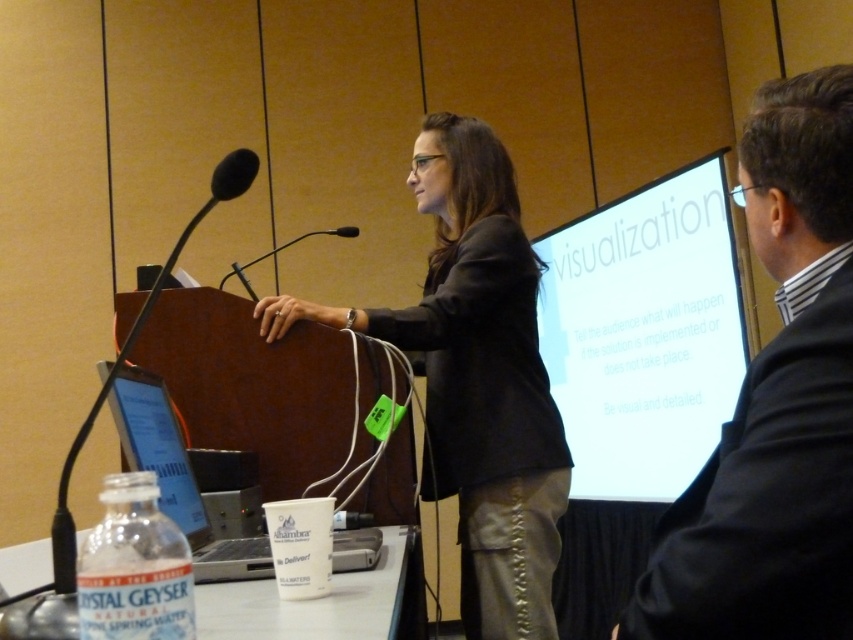
Question: Is transparent plastic screen at lower left further to camera compared to black plastic microphone at center?

Choices:
 (A) no
 (B) yes

Answer: (A)

Question: Which of the following is the closest to the observer?

Choices:
 (A) (247, 285)
 (B) (799, 410)

Answer: (B)

Question: Among these points, which one is farthest from the camera?

Choices:
 (A) (231, 189)
 (B) (234, 264)

Answer: (B)

Question: Is dark gray blazer at center below transparent plastic screen at lower left?

Choices:
 (A) no
 (B) yes

Answer: (A)

Question: Which of the following is the farthest from the observer?

Choices:
 (A) black matte microphone at upper left
 (B) black matte microphone at center

Answer: (B)

Question: Does black matte microphone at left lie behind black matte microphone at upper left?

Choices:
 (A) no
 (B) yes

Answer: (A)